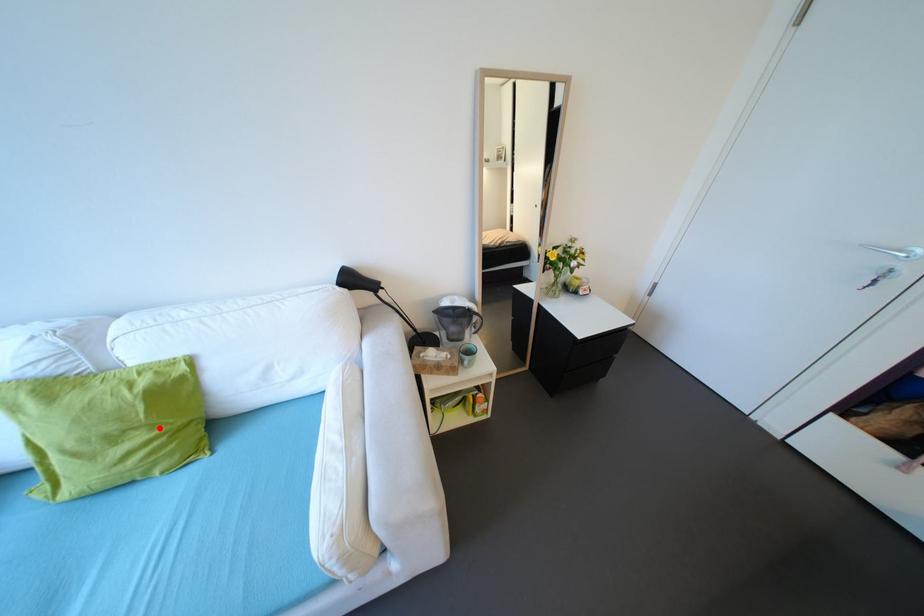
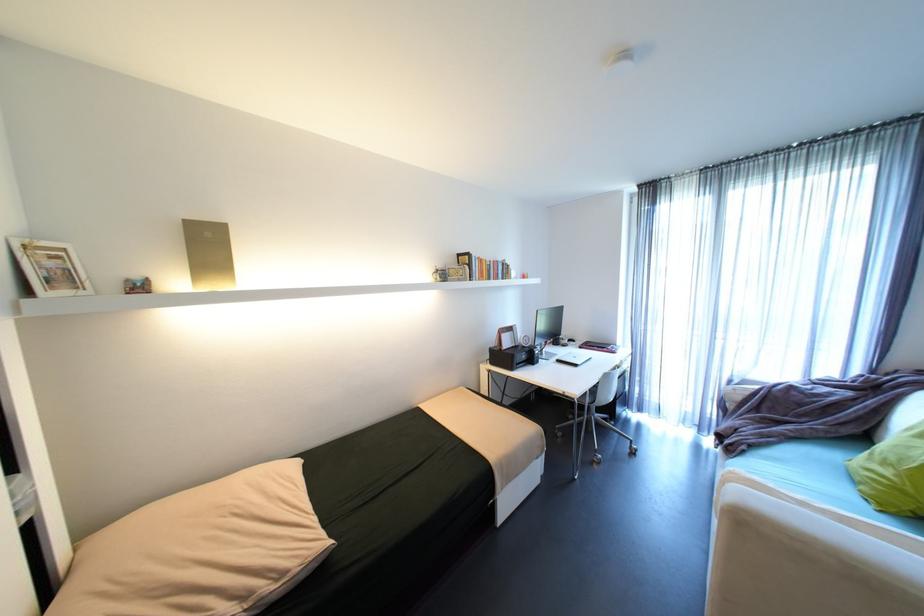
Question: I am providing you with two images of the same scene from different viewpoints. Given a red point in image1, look at the same physical point in image2. Is it:

Choices:
 (A) Closer to the viewpoint
 (B) Farther from the viewpoint

Answer: (B)